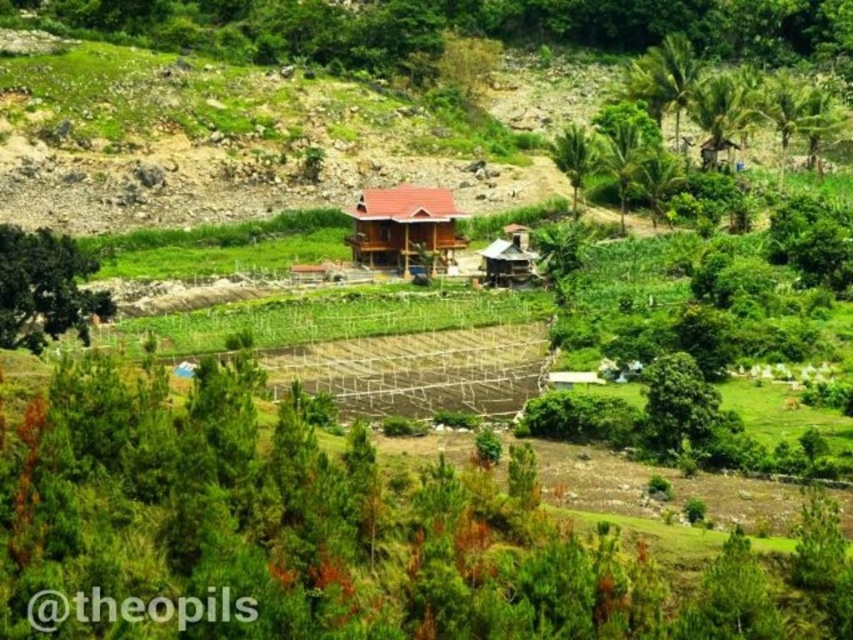
Which of these two, green leafy tree at left or brown wooden hut at center, stands shorter?

green leafy tree at left

Does green leafy tree at left have a greater width compared to brown wooden hut at center?

Correct, the width of green leafy tree at left exceeds that of brown wooden hut at center.

Find the location of `green leafy tree at left`. green leafy tree at left is located at coordinates (45, 289).

Is green grassy hillside at upper center bigger than green leafy tree at center-right?

Yes, green grassy hillside at upper center is bigger than green leafy tree at center-right.

Who is more distant from viewer, (27, 163) or (582, 182)?

Point (582, 182)

Between point (154, 132) and point (555, 156), which one is positioned behind?

The point (154, 132) is behind.

Locate an element on the screen. green grassy hillside at upper center is located at coordinates (212, 140).

Does green leafy tree at left have a greater width compared to green leafy tree at upper right?

Yes.

Does green leafy tree at left appear on the right side of green leafy tree at upper right?

In fact, green leafy tree at left is to the left of green leafy tree at upper right.

Identify the location of green leafy tree at left. (45, 289).

Find the location of `green leafy tree at left`. green leafy tree at left is located at coordinates (45, 289).